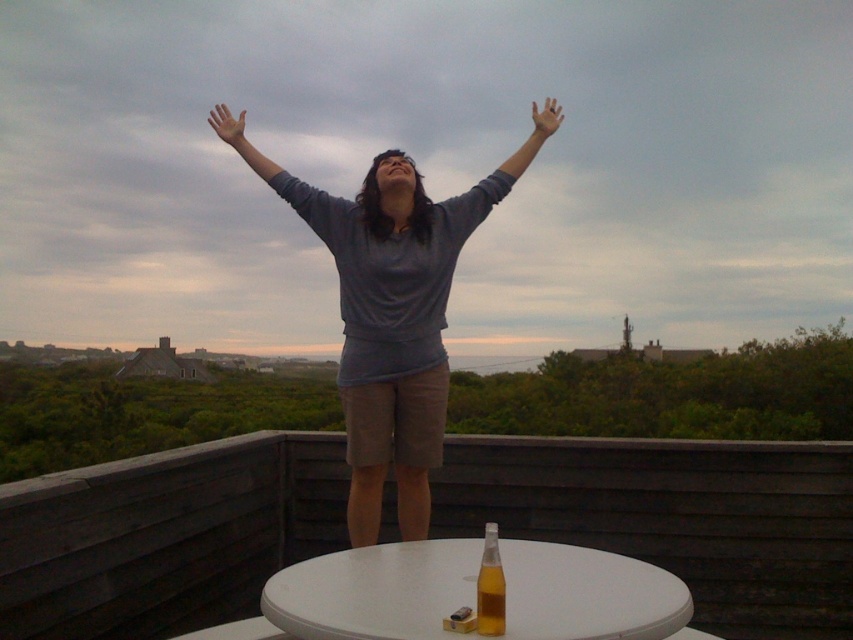
Question: Among these objects, which one is nearest to the camera?

Choices:
 (A) matte blue shirt at center
 (B) white plastic table at lower center
 (C) matte skin hand at upper center
 (D) translucent glass bottle at center

Answer: (B)

Question: Which of these objects is positioned closest to the gray matte arm at upper center?

Choices:
 (A) white plastic table at lower center
 (B) skinny flesh-toned hand at upper center
 (C) translucent glass bottle at center

Answer: (B)

Question: Is the position of white plastic table at lower center less distant than that of translucent glass bottle at center?

Choices:
 (A) yes
 (B) no

Answer: (A)

Question: Which object appears farthest from the camera in this image?

Choices:
 (A) gray cotton sweater at center
 (B) matte blue shirt at center

Answer: (B)

Question: Considering the relative positions of white plastic table at lower center and skinny flesh-toned hand at upper center in the image provided, where is white plastic table at lower center located with respect to skinny flesh-toned hand at upper center?

Choices:
 (A) below
 (B) above

Answer: (A)

Question: From the image, what is the correct spatial relationship of white plastic table at lower center in relation to translucent glass bottle at center?

Choices:
 (A) left
 (B) right

Answer: (A)